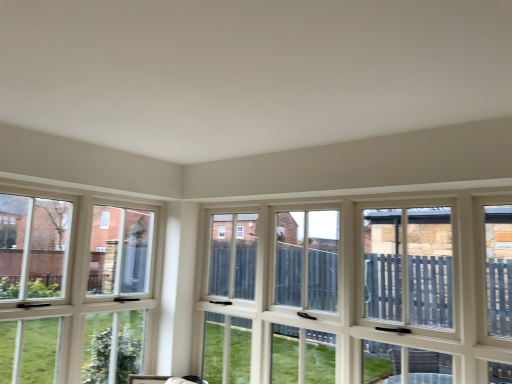
This screenshot has height=384, width=512. What do you see at coordinates (361, 293) in the screenshot? I see `white wood window at center, which is the 1th window from right to left` at bounding box center [361, 293].

The width and height of the screenshot is (512, 384). What are the coordinates of `white wood window at center, the second window when ordered from left to right` in the screenshot? It's located at (361, 293).

The image size is (512, 384). In order to click on white wood window at left, which is the 2th window from right to left in this screenshot , I will do `click(72, 290)`.

What do you see at coordinates (72, 290) in the screenshot? Image resolution: width=512 pixels, height=384 pixels. I see `white wood window at left, the first window viewed from the left` at bounding box center [72, 290].

In order to click on white wood window at center, the second window when ordered from left to right in this screenshot , I will do `click(361, 293)`.

Considering the positions of objects white wood window at center, the second window when ordered from left to right, and white wood window at left, the first window viewed from the left, in the image provided, who is more to the left, white wood window at center, the second window when ordered from left to right, or white wood window at left, the first window viewed from the left,?

Positioned to the left is white wood window at left, the first window viewed from the left.

Does white wood window at center, the second window when ordered from left to right, come behind white wood window at left, which is the 2th window from right to left?

That is False.

Does point (426, 372) lie behind point (3, 381)?

No, it is in front of (3, 381).

From the image's perspective, is white wood window at center, which is the 1th window from right to left, above or below white wood window at left, the first window viewed from the left?

Clearly, from the image's perspective, white wood window at center, which is the 1th window from right to left, is below white wood window at left, the first window viewed from the left.

From a real-world perspective, is white wood window at center, the second window when ordered from left to right, on top of white wood window at left, which is the 2th window from right to left?

Correct, in the physical world, white wood window at center, the second window when ordered from left to right, is higher than white wood window at left, which is the 2th window from right to left.

Is white wood window at center, which is the 1th window from right to left, wider or thinner than white wood window at left, the first window viewed from the left?

Clearly, white wood window at center, which is the 1th window from right to left, has more width compared to white wood window at left, the first window viewed from the left.

Considering the relative sizes of white wood window at center, which is the 1th window from right to left, and white wood window at left, the first window viewed from the left, in the image provided, is white wood window at center, which is the 1th window from right to left, shorter than white wood window at left, the first window viewed from the left,?

Yes.

Based on their sizes in the image, would you say white wood window at center, which is the 1th window from right to left, is bigger or smaller than white wood window at left, the first window viewed from the left?

Considering their sizes, white wood window at center, which is the 1th window from right to left, takes up more space than white wood window at left, the first window viewed from the left.

Is white wood window at center, the second window when ordered from left to right, spatially inside white wood window at left, the first window viewed from the left, or outside of it?

white wood window at center, the second window when ordered from left to right, is outside white wood window at left, the first window viewed from the left.

Are white wood window at center, which is the 1th window from right to left, and white wood window at left, the first window viewed from the left, making contact?

No, white wood window at center, which is the 1th window from right to left, is not with white wood window at left, the first window viewed from the left.

Is white wood window at center, the second window when ordered from left to right, facing away from white wood window at left, which is the 2th window from right to left?

No.

Could you measure the distance between white wood window at center, the second window when ordered from left to right, and white wood window at left, which is the 2th window from right to left?

The distance of white wood window at center, the second window when ordered from left to right, from white wood window at left, which is the 2th window from right to left, is 1.02 meters.

Locate an element on the screen. The width and height of the screenshot is (512, 384). window above the white wood window at left, the first window viewed from the left (from a real-world perspective) is located at coordinates (361, 293).

Considering the relative positions of white wood window at left, the first window viewed from the left, and white wood window at center, which is the 1th window from right to left, in the image provided, is white wood window at left, the first window viewed from the left, to the right of white wood window at center, which is the 1th window from right to left, from the viewer's perspective?

In fact, white wood window at left, the first window viewed from the left, is to the left of white wood window at center, which is the 1th window from right to left.

Which is in front, white wood window at left, the first window viewed from the left, or white wood window at center, which is the 1th window from right to left?

white wood window at center, which is the 1th window from right to left, is more forward.

Does point (91, 234) come farther from viewer compared to point (403, 354)?

That is True.

From the image's perspective, is white wood window at left, the first window viewed from the left, located above white wood window at center, which is the 1th window from right to left?

Yes.

From a real-world perspective, does white wood window at left, which is the 2th window from right to left, sit lower than white wood window at center, the second window when ordered from left to right?

Correct, in the physical world, white wood window at left, which is the 2th window from right to left, is lower than white wood window at center, the second window when ordered from left to right.

Does white wood window at left, which is the 2th window from right to left, have a greater width compared to white wood window at center, which is the 1th window from right to left?

No.

Considering the sizes of white wood window at left, the first window viewed from the left, and white wood window at center, the second window when ordered from left to right, in the image, is white wood window at left, the first window viewed from the left, taller or shorter than white wood window at center, the second window when ordered from left to right,?

Considering their sizes, white wood window at left, the first window viewed from the left, has more height than white wood window at center, the second window when ordered from left to right.

Which of these two, white wood window at left, which is the 2th window from right to left, or white wood window at center, which is the 1th window from right to left, is smaller?

white wood window at left, which is the 2th window from right to left, is smaller.

Is white wood window at center, which is the 1th window from right to left, surrounded by white wood window at left, which is the 2th window from right to left?

That's incorrect, white wood window at center, which is the 1th window from right to left, is not inside white wood window at left, which is the 2th window from right to left.

Is white wood window at left, the first window viewed from the left, far from white wood window at center, the second window when ordered from left to right?

white wood window at left, the first window viewed from the left, is far away from white wood window at center, the second window when ordered from left to right.

Is white wood window at left, the first window viewed from the left, turned away from white wood window at center, the second window when ordered from left to right?

That's not correct — white wood window at left, the first window viewed from the left, is not looking away from white wood window at center, the second window when ordered from left to right.

What's the angular difference between white wood window at left, which is the 2th window from right to left, and white wood window at center, the second window when ordered from left to right,'s facing directions?

90.3 degrees.

How distant is white wood window at left, which is the 2th window from right to left, from white wood window at center, the second window when ordered from left to right?

white wood window at left, which is the 2th window from right to left, is 3.35 feet from white wood window at center, the second window when ordered from left to right.

Identify the location of window behind the white wood window at center, which is the 1th window from right to left. The width and height of the screenshot is (512, 384). (72, 290).

The height and width of the screenshot is (384, 512). In order to click on window behind the white wood window at center, which is the 1th window from right to left in this screenshot , I will do `click(72, 290)`.

Find the location of `window on the right of the white wood window at left, which is the 2th window from right to left`. window on the right of the white wood window at left, which is the 2th window from right to left is located at coordinates (361, 293).